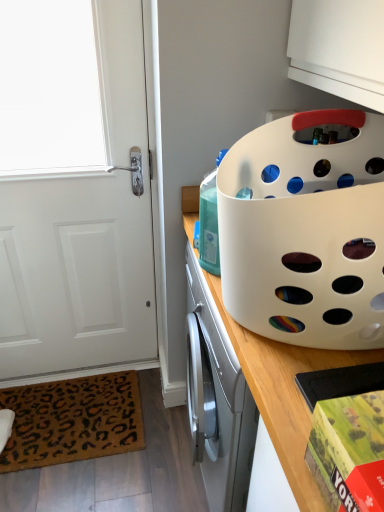
Question: Should I look upward or downward to see white plastic basket at upper right?

Choices:
 (A) down
 (B) up

Answer: (A)

Question: Is red matte board game box at lower right turned away from white plastic basket at upper right?

Choices:
 (A) no
 (B) yes

Answer: (A)

Question: From a real-world perspective, is red matte board game box at lower right beneath white plastic basket at upper right?

Choices:
 (A) no
 (B) yes

Answer: (A)

Question: Does red matte board game box at lower right have a greater width compared to white plastic basket at upper right?

Choices:
 (A) yes
 (B) no

Answer: (B)

Question: Is red matte board game box at lower right to the right of white plastic basket at upper right from the viewer's perspective?

Choices:
 (A) no
 (B) yes

Answer: (A)

Question: Does red matte board game box at lower right have a smaller size compared to white plastic basket at upper right?

Choices:
 (A) yes
 (B) no

Answer: (A)

Question: From a real-world perspective, does red matte board game box at lower right stand above white plastic basket at upper right?

Choices:
 (A) yes
 (B) no

Answer: (A)

Question: Is white plastic basket at upper right in contact with white plastic basket at upper right?

Choices:
 (A) yes
 (B) no

Answer: (B)

Question: Is white plastic basket at upper right located outside white plastic basket at upper right?

Choices:
 (A) no
 (B) yes

Answer: (B)

Question: Can you confirm if white plastic basket at upper right is positioned to the right of white plastic basket at upper right?

Choices:
 (A) yes
 (B) no

Answer: (A)

Question: Would you consider white plastic basket at upper right to be distant from white plastic basket at upper right?

Choices:
 (A) no
 (B) yes

Answer: (A)

Question: Is white plastic basket at upper right wider than white plastic basket at upper right?

Choices:
 (A) no
 (B) yes

Answer: (A)

Question: From a real-world perspective, is white plastic basket at upper right beneath white plastic basket at upper right?

Choices:
 (A) no
 (B) yes

Answer: (A)

Question: Could you tell me if brown leopard print mat at lower left is turned towards white matte door at left?

Choices:
 (A) yes
 (B) no

Answer: (B)